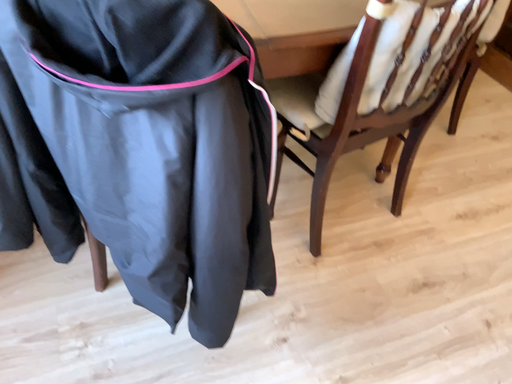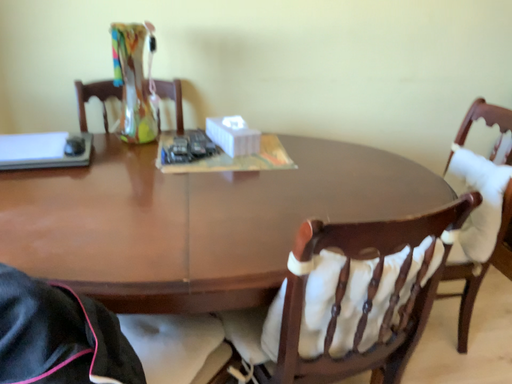
Question: How did the camera likely rotate when shooting the video?

Choices:
 (A) rotated upward
 (B) rotated downward

Answer: (A)